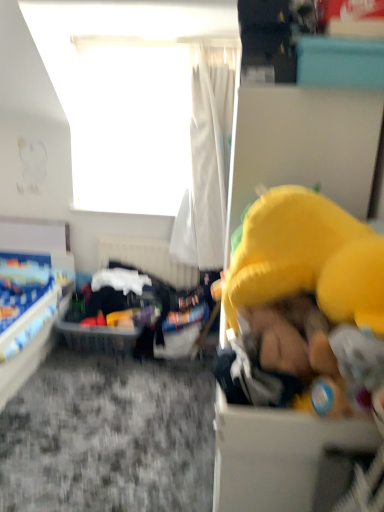
Identify the location of teal plastic box at upper right, which is the second box in front-to-back order. This screenshot has width=384, height=512. (340, 62).

In order to click on transparent plastic window screen at upper center in this screenshot , I will do `click(130, 125)`.

What is the approximate height of translucent plastic basket at center?

translucent plastic basket at center is 36.13 centimeters in height.

What do you see at coordinates (211, 148) in the screenshot?
I see `white sheer curtain at upper center` at bounding box center [211, 148].

The image size is (384, 512). Describe the element at coordinates (31, 295) in the screenshot. I see `blue fabric bed at lower left` at that location.

In order to click on teal plastic box at upper right, acting as the 2th box starting from the bottom in this screenshot , I will do `click(340, 62)`.

Is white fabric bed frame at center not close to transparent plastic window screen at upper center?

white fabric bed frame at center is actually quite close to transparent plastic window screen at upper center.

Where is `window screen above the white fabric bed frame at center (from the image's perspective)`? This screenshot has width=384, height=512. window screen above the white fabric bed frame at center (from the image's perspective) is located at coordinates (130, 125).

From the image's perspective, is white fabric bed frame at center beneath transparent plastic window screen at upper center?

Indeed, from the image's perspective, white fabric bed frame at center is shown beneath transparent plastic window screen at upper center.

Find the location of `toy that is above the yellow fabric toy at right, the first box from the left (from the image's perspective)`. toy that is above the yellow fabric toy at right, the first box from the left (from the image's perspective) is located at coordinates (301, 298).

Based on the photo, from the image's perspective, is yellow plush toy at right on yellow fabric toy at right, the second box when ordered from right to left?

Yes, from the image's perspective, yellow plush toy at right is over yellow fabric toy at right, the second box when ordered from right to left.

Considering the sizes of yellow plush toy at right and yellow fabric toy at right, which is the second box in back-to-front order, in the image, is yellow plush toy at right taller or shorter than yellow fabric toy at right, which is the second box in back-to-front order,?

Clearly, yellow plush toy at right is taller compared to yellow fabric toy at right, which is the second box in back-to-front order.

Between white fabric bed frame at center and clear plastic basket at center, which one is positioned in front?

clear plastic basket at center is closer to the camera.

Which is less distant, (x=151, y=270) or (x=72, y=329)?

Point (x=151, y=270) appears to be farther away from the viewer than point (x=72, y=329).

From the image's perspective, between white fabric bed frame at center and clear plastic basket at center, who is located below?

From the image's view, clear plastic basket at center is below.

Between white fabric bed frame at center and clear plastic basket at center, which one has more height?

white fabric bed frame at center is taller.

Does clear plastic basket at center have a greater width compared to white fabric bed frame at center?

Correct, the width of clear plastic basket at center exceeds that of white fabric bed frame at center.

You are a GUI agent. You are given a task and a screenshot of the screen. Output one action in this format:
    pyautogui.click(x=<x>, y=<y>)
    Task: Click on the bed frame behind the clear plastic basket at center
    The width and height of the screenshot is (384, 512).
    Given the screenshot: What is the action you would take?
    pyautogui.click(x=148, y=259)

In the scene shown: Can you confirm if clear plastic basket at center is bigger than white fabric bed frame at center?

Yes.

Does teal plastic box at upper right, which is the 1th box in back-to-front order, have a lesser width compared to yellow plush toy at right?

Yes.

Based on their positions, is teal plastic box at upper right, positioned as the first box in right-to-left order, located to the left or right of yellow plush toy at right?

Clearly, teal plastic box at upper right, positioned as the first box in right-to-left order, is on the right of yellow plush toy at right in the image.

In the image, is teal plastic box at upper right, which is the second box in front-to-back order, positioned in front of or behind yellow plush toy at right?

Visually, teal plastic box at upper right, which is the second box in front-to-back order, is located behind yellow plush toy at right.

Is white sheer curtain at upper center completely or partially outside of transparent plastic window screen at upper center?

Absolutely, white sheer curtain at upper center is external to transparent plastic window screen at upper center.

Which is more to the right, white sheer curtain at upper center or transparent plastic window screen at upper center?

From the viewer's perspective, white sheer curtain at upper center appears more on the right side.

Is white sheer curtain at upper center positioned with its back to transparent plastic window screen at upper center?

Yes, white sheer curtain at upper center is facing away from transparent plastic window screen at upper center.

Is white sheer curtain at upper center positioned far away from transparent plastic window screen at upper center?

Actually, white sheer curtain at upper center and transparent plastic window screen at upper center are a little close together.

From the image's perspective, would you say translucent plastic basket at center is positioned over clear plastic basket at center?

Indeed, from the image's perspective, translucent plastic basket at center is shown above clear plastic basket at center.

Which object is positioned more to the left, translucent plastic basket at center or clear plastic basket at center?

clear plastic basket at center is more to the left.

In the scene shown: Which of these two, translucent plastic basket at center or clear plastic basket at center, is wider?

With larger width is clear plastic basket at center.

Where is `bed frame lying below the transparent plastic window screen at upper center (from the image's perspective)`? bed frame lying below the transparent plastic window screen at upper center (from the image's perspective) is located at coordinates (148, 259).

Find the location of a particular element. toy behind the yellow fabric toy at right, the first box from the left is located at coordinates (301, 298).

Which object lies further to the anchor point translucent plastic basket at center, clear plastic basket at center or yellow fabric toy at right, which is the first box in bottom-to-top order?

Based on the image, yellow fabric toy at right, which is the first box in bottom-to-top order, appears to be further to translucent plastic basket at center.

When comparing their distances from white fabric bed frame at center, does transparent plastic window screen at upper center or blue fabric bed at lower left seem further?

transparent plastic window screen at upper center is further to white fabric bed frame at center.

Based on their spatial positions, is clear plastic basket at center or yellow plush toy at right further from translucent plastic basket at center?

yellow plush toy at right is positioned further to the anchor translucent plastic basket at center.

Estimate the real-world distances between objects in this image. Which object is closer to translucent plastic basket at center, clear plastic basket at center or teal plastic box at upper right, positioned as the second box in left-to-right order?

The object closer to translucent plastic basket at center is clear plastic basket at center.

Based on their spatial positions, is yellow plush toy at right or teal plastic box at upper right, acting as the 2th box starting from the bottom, closer to blue fabric bed at lower left?

yellow plush toy at right is positioned closer to the anchor blue fabric bed at lower left.

Looking at the image, which one is located closer to clear plastic basket at center, white fabric bed frame at center or teal plastic box at upper right, marked as the first box in a top-to-bottom arrangement?

white fabric bed frame at center lies closer to clear plastic basket at center than the other object.

Considering their positions, is transparent plastic window screen at upper center positioned closer to yellow fabric toy at right, the second box from the top, than white sheer curtain at upper center?

white sheer curtain at upper center is closer to yellow fabric toy at right, the second box from the top.

From the image, which object appears to be farther from blue fabric bed at lower left, transparent plastic window screen at upper center or white fabric bed frame at center?

Based on the image, transparent plastic window screen at upper center appears to be further to blue fabric bed at lower left.

Locate an element on the screen. The height and width of the screenshot is (512, 384). basket between teal plastic box at upper right, marked as the first box in a top-to-bottom arrangement, and white fabric bed frame at center in the front-back direction is located at coordinates (98, 338).

This screenshot has height=512, width=384. What are the coordinates of `bed between yellow plush toy at right and white sheer curtain at upper center from front to back` in the screenshot? It's located at (31, 295).

Locate an element on the screen. The image size is (384, 512). bed positioned between yellow fabric toy at right, which is the first box in bottom-to-top order, and translucent plastic basket at center from near to far is located at coordinates (31, 295).

At what (x,y) coordinates should I click in order to perform the action: click on infant bed between blue fabric bed at lower left and teal plastic box at upper right, positioned as the first box in right-to-left order, from left to right. Please return your answer as a coordinate pair (x, y). This screenshot has height=512, width=384. Looking at the image, I should click on (142, 276).